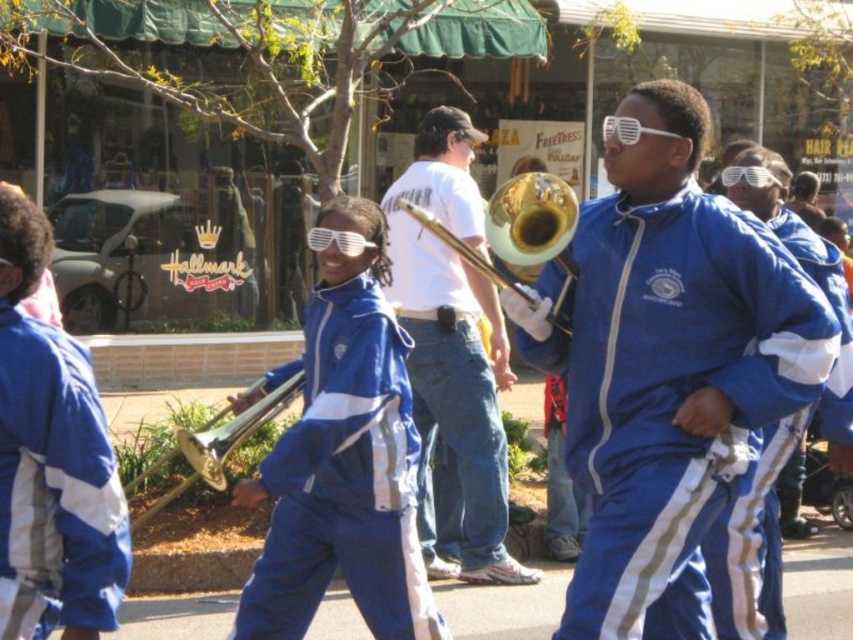
Can you confirm if blue matte uniform at center is bigger than white plastic trombone at center?

No.

Who is more distant from viewer, (320, 208) or (456, 349)?

The point (320, 208) is more distant.

I want to click on blue matte uniform at center, so click(341, 452).

Is gold/yellow brass trumpet at center closer to camera compared to gold brass trumpet at center?

Yes, gold/yellow brass trumpet at center is closer to the viewer.

You are a GUI agent. You are given a task and a screenshot of the screen. Output one action in this format:
    pyautogui.click(x=<x>, y=<y>)
    Task: Click on the gold/yellow brass trumpet at center
    
    Given the screenshot: What is the action you would take?
    pyautogui.click(x=534, y=232)

Is point (200, 442) positioned behind point (413, 212)?

That is True.

From the picture: Does gold brass trumpet at center appear under gold shiny trumpet at center?

Yes, gold brass trumpet at center is below gold shiny trumpet at center.

The width and height of the screenshot is (853, 640). What are the coordinates of `gold brass trumpet at center` in the screenshot? It's located at (215, 445).